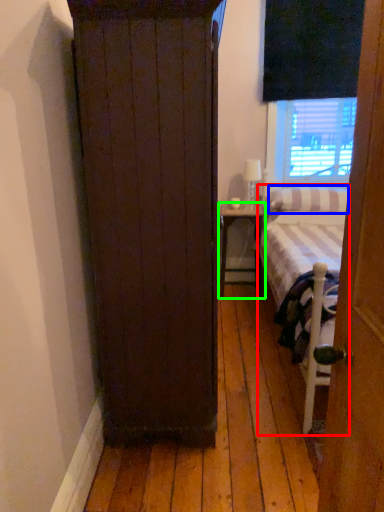
Question: Which object is the farthest from bed (highlighted by a red box)? Choose among these: pillow (highlighted by a blue box) or nightstand (highlighted by a green box).

Choices:
 (A) pillow
 (B) nightstand

Answer: (B)